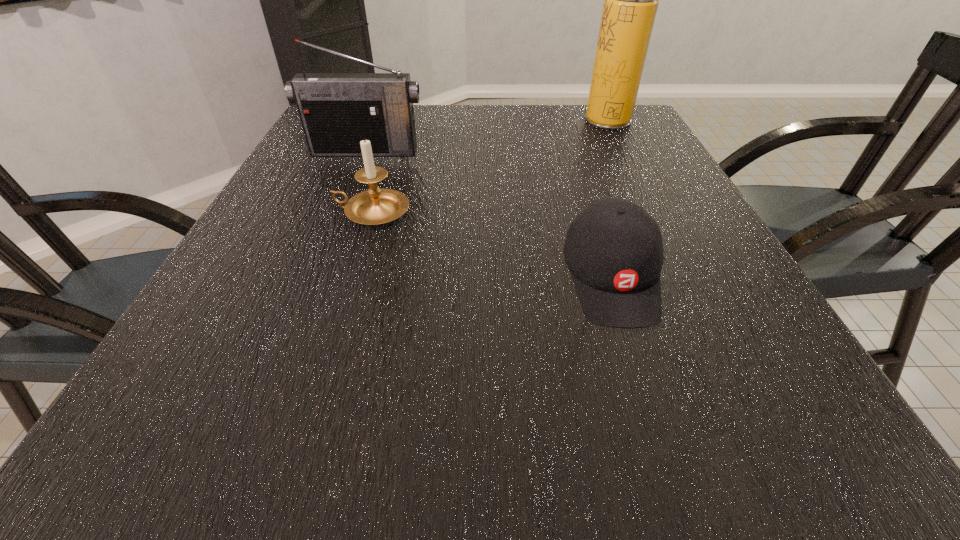
Find the location of `object that is the third closest to the aerosol can`. object that is the third closest to the aerosol can is located at coordinates (375, 206).

The height and width of the screenshot is (540, 960). In order to click on the second closest object to the second shortest object in this screenshot , I will do `click(613, 248)`.